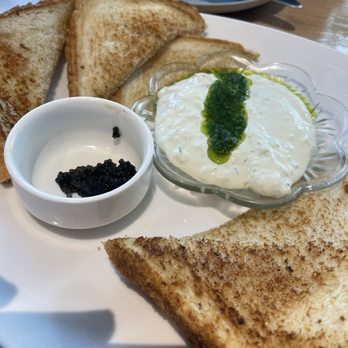
Find the location of a particular element. edge of white dish is located at coordinates (235, 6), (208, 8).